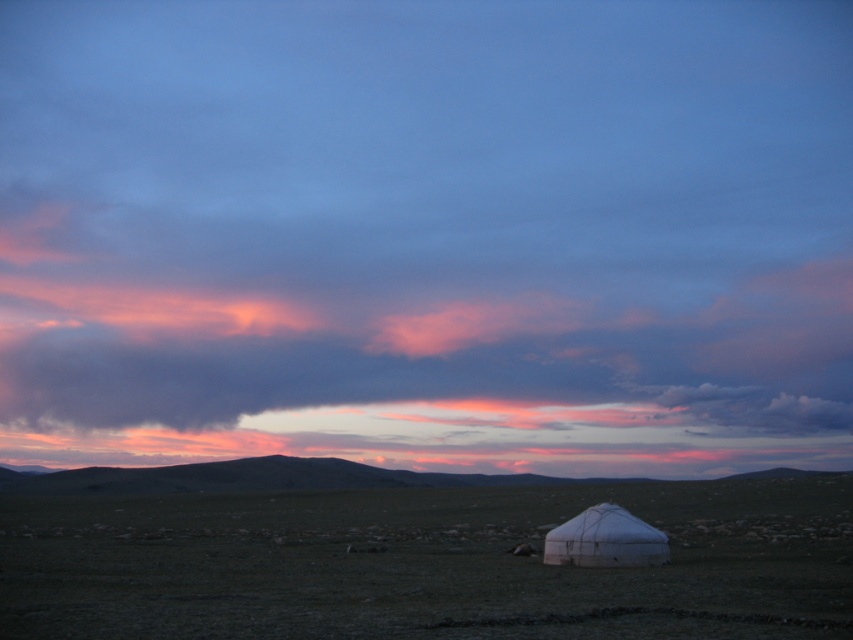
Question: Where is green grassland at lower center located in relation to white fabric tent at lower center in the image?

Choices:
 (A) left
 (B) right

Answer: (B)

Question: Which object is positioned closest to the dark gray cloud at upper center?

Choices:
 (A) white fabric tent at lower center
 (B) green grassland at lower center
 (C) smooth earthy horizon at center

Answer: (C)

Question: Which point is closer to the camera?

Choices:
 (A) (561, 545)
 (B) (792, 352)
 (C) (282, 554)
 (D) (102, 488)

Answer: (A)

Question: Which point is closer to the camera?

Choices:
 (A) white fabric tent at lower center
 (B) dark gray cloud at upper center
 (C) smooth earthy horizon at center
 (D) green grassland at lower center

Answer: (D)

Question: Does dark gray cloud at upper center appear on the right side of smooth earthy horizon at center?

Choices:
 (A) yes
 (B) no

Answer: (B)

Question: Is green grassland at lower center wider than white fabric tent at lower center?

Choices:
 (A) yes
 (B) no

Answer: (A)